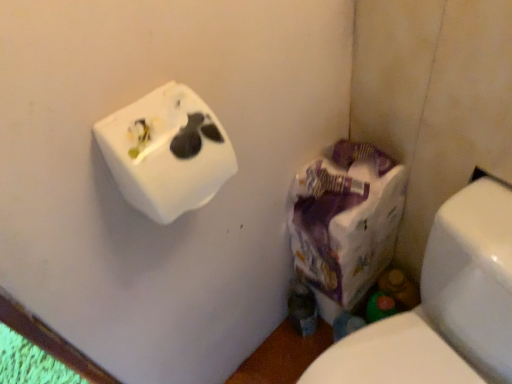
Question: From a real-world perspective, is purple paper bag at lower right located higher than white matte tissue box at upper left?

Choices:
 (A) no
 (B) yes

Answer: (A)

Question: Does purple paper bag at lower right have a lesser height compared to white matte tissue box at upper left?

Choices:
 (A) no
 (B) yes

Answer: (A)

Question: Considering the relative sizes of purple paper bag at lower right and white matte tissue box at upper left in the image provided, is purple paper bag at lower right taller than white matte tissue box at upper left?

Choices:
 (A) no
 (B) yes

Answer: (B)

Question: Would you say purple paper bag at lower right is a long distance from white matte tissue box at upper left?

Choices:
 (A) yes
 (B) no

Answer: (B)

Question: Is purple paper bag at lower right wider than white matte tissue box at upper left?

Choices:
 (A) no
 (B) yes

Answer: (B)

Question: Is purple paper bag at lower right smaller than white matte tissue box at upper left?

Choices:
 (A) yes
 (B) no

Answer: (B)

Question: Considering the relative positions of purple paper bag at lower right and white glossy toilet at lower right in the image provided, is purple paper bag at lower right behind white glossy toilet at lower right?

Choices:
 (A) yes
 (B) no

Answer: (A)

Question: Is purple paper bag at lower right shorter than white glossy toilet at lower right?

Choices:
 (A) yes
 (B) no

Answer: (A)

Question: Considering the relative positions of purple paper bag at lower right and white glossy toilet at lower right in the image provided, is purple paper bag at lower right to the left of white glossy toilet at lower right from the viewer's perspective?

Choices:
 (A) no
 (B) yes

Answer: (B)

Question: From a real-world perspective, is purple paper bag at lower right over white glossy toilet at lower right?

Choices:
 (A) yes
 (B) no

Answer: (A)

Question: Considering the relative sizes of purple paper bag at lower right and white glossy toilet at lower right in the image provided, is purple paper bag at lower right taller than white glossy toilet at lower right?

Choices:
 (A) no
 (B) yes

Answer: (A)

Question: Is purple paper bag at lower right smaller than white glossy toilet at lower right?

Choices:
 (A) yes
 (B) no

Answer: (A)

Question: From a real-world perspective, is white matte tissue box at upper left under white glossy toilet at lower right?

Choices:
 (A) no
 (B) yes

Answer: (A)